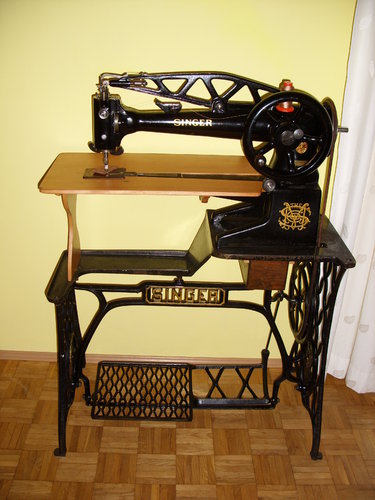
At what (x,y) coordinates should I click in order to perform the action: click on yellow wall. Please return your answer as a coordinate pair (x, y). Looking at the image, I should click on (126, 213), (218, 270), (247, 295), (205, 356), (99, 306), (112, 293), (24, 257), (156, 143), (142, 101), (227, 24).